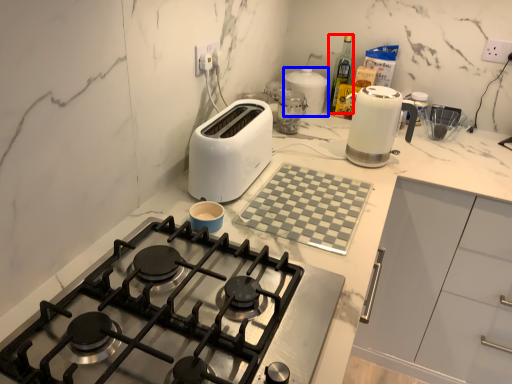
Question: Among these objects, which one is nearest to the camera, bottle (highlighted by a red box) or kitchen appliance (highlighted by a blue box)?

Choices:
 (A) bottle
 (B) kitchen appliance

Answer: (B)